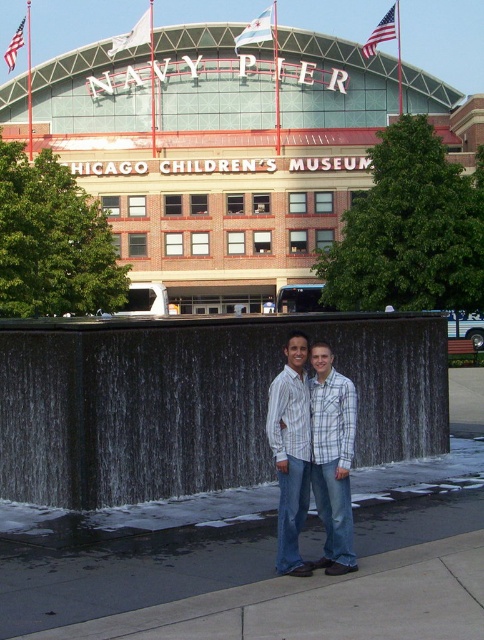
You are standing at the entrance of the Chicago Childrens Museum and want to find the black stone waterfall. According to the map, it is located at point (196, 401). Can you confirm if the black stone waterfall at center is indeed at that coordinate?

Yes, the black stone waterfall at center is located at point (196, 401), so it matches the coordinate provided.